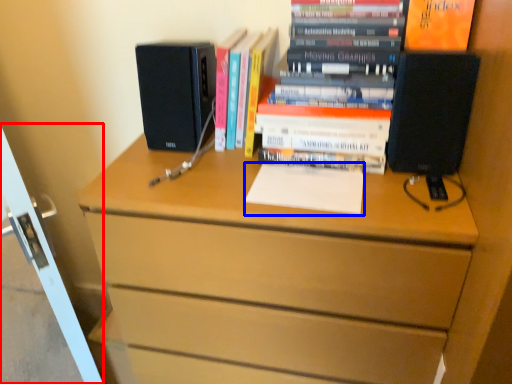
Question: Among these objects, which one is nearest to the camera, screen door (highlighted by a red box) or notepad (highlighted by a blue box)?

Choices:
 (A) screen door
 (B) notepad

Answer: (A)